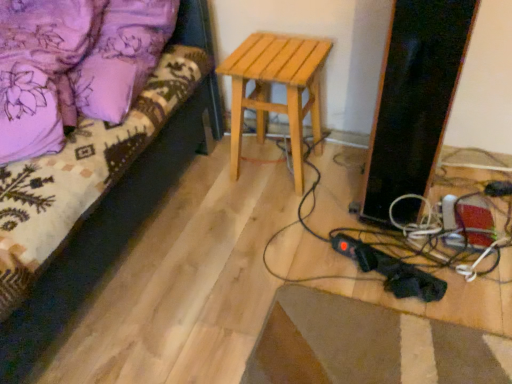
Identify the location of vacant area that is situated to the right of light brown wooden stool at center. The image size is (512, 384). (340, 168).